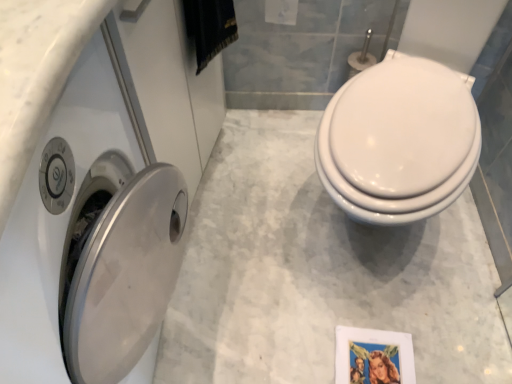
Question: Is white glossy toilet at right shorter than metallic silver picture frame at lower right?

Choices:
 (A) no
 (B) yes

Answer: (A)

Question: Does white glossy toilet at right appear on the left side of metallic silver picture frame at lower right?

Choices:
 (A) yes
 (B) no

Answer: (B)

Question: Would you say white glossy toilet at right is a long distance from metallic silver picture frame at lower right?

Choices:
 (A) yes
 (B) no

Answer: (B)

Question: From a real-world perspective, is white glossy toilet at right positioned under metallic silver picture frame at lower right based on gravity?

Choices:
 (A) no
 (B) yes

Answer: (A)

Question: Is white glossy toilet at right with metallic silver picture frame at lower right?

Choices:
 (A) yes
 (B) no

Answer: (B)

Question: Is white glossy toilet paper at upper center in front of or behind satin silver washer at left in the image?

Choices:
 (A) front
 (B) behind

Answer: (B)

Question: Would you say white glossy toilet paper at upper center is to the left or to the right of satin silver washer at left in the picture?

Choices:
 (A) left
 (B) right

Answer: (B)

Question: From a real-world perspective, relative to satin silver washer at left, is white glossy toilet paper at upper center vertically above or below?

Choices:
 (A) below
 (B) above

Answer: (B)

Question: Is white glossy toilet paper at upper center situated inside satin silver washer at left or outside?

Choices:
 (A) outside
 (B) inside

Answer: (A)

Question: From their relative heights in the image, would you say metallic silver picture frame at lower right is taller or shorter than white glossy toilet at right?

Choices:
 (A) tall
 (B) short

Answer: (B)

Question: Based on their positions, is metallic silver picture frame at lower right located to the left or right of white glossy toilet at right?

Choices:
 (A) right
 (B) left

Answer: (B)

Question: Is metallic silver picture frame at lower right spatially inside white glossy toilet at right, or outside of it?

Choices:
 (A) outside
 (B) inside

Answer: (A)

Question: In terms of width, does metallic silver picture frame at lower right look wider or thinner when compared to white glossy toilet at right?

Choices:
 (A) wide
 (B) thin

Answer: (B)

Question: In terms of size, does satin silver washer at left appear bigger or smaller than white glossy toilet paper at upper center?

Choices:
 (A) small
 (B) big

Answer: (B)

Question: From the image's perspective, relative to white glossy toilet paper at upper center, is satin silver washer at left above or below?

Choices:
 (A) below
 (B) above

Answer: (A)